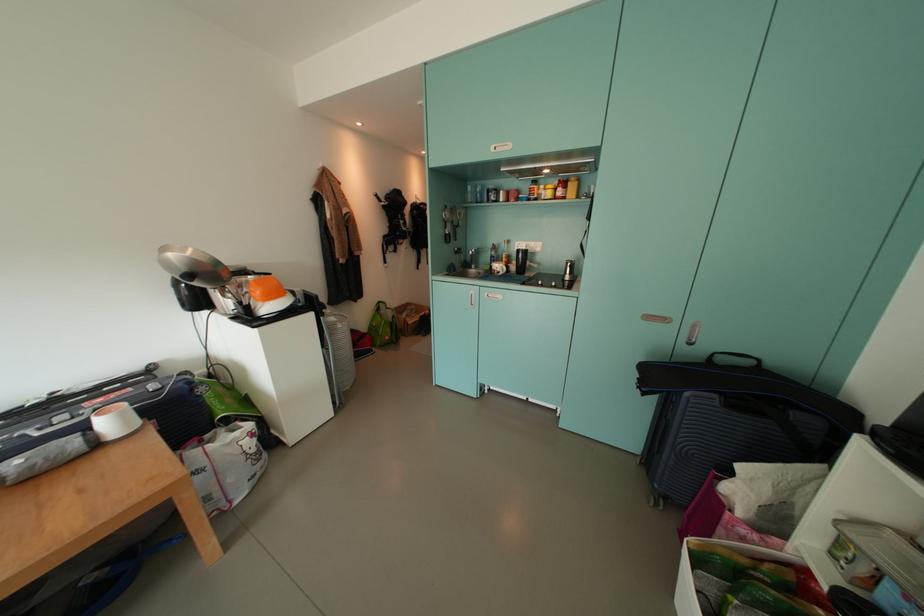
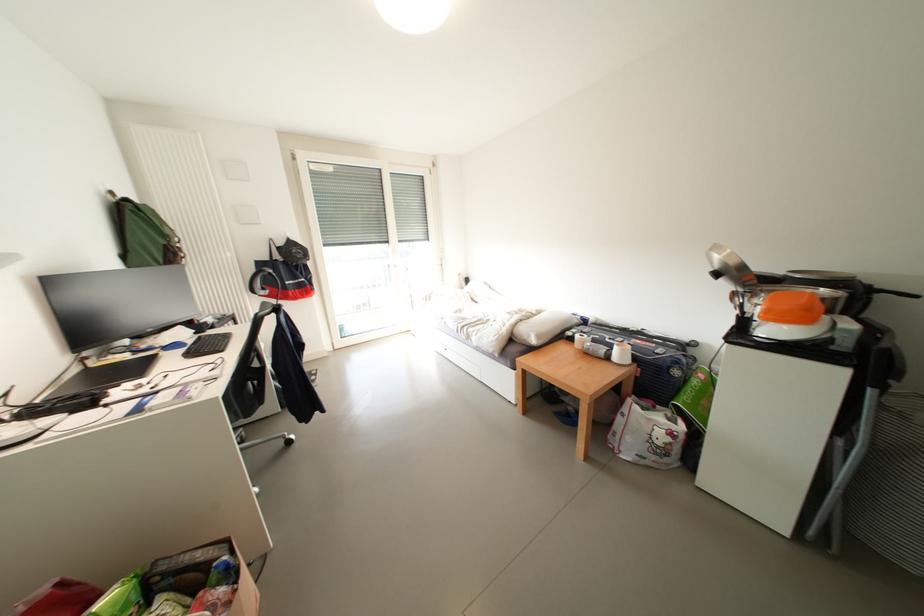
Locate, in the second image, the point that corresponds to (x=200, y=392) in the first image.

(677, 371)